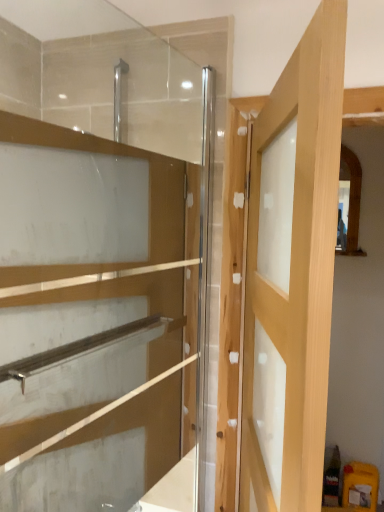
This screenshot has height=512, width=384. Describe the element at coordinates (89, 317) in the screenshot. I see `transparent glass cabinet at upper left` at that location.

Identify the location of transparent glass cabinet at upper left. (89, 317).

Where is `light wood door at center`? The image size is (384, 512). light wood door at center is located at coordinates (303, 246).

Describe the element at coordinates (303, 246) in the screenshot. The width and height of the screenshot is (384, 512). I see `light wood door at center` at that location.

This screenshot has height=512, width=384. In order to click on transparent glass cabinet at upper left in this screenshot , I will do `click(89, 317)`.

Is light wood door at center at the right side of transparent glass cabinet at upper left?

Yes.

Considering the positions of objects light wood door at center and transparent glass cabinet at upper left in the image provided, who is in front, light wood door at center or transparent glass cabinet at upper left?

light wood door at center is in front.

Is point (296, 283) behind point (99, 493)?

No, it is in front of (99, 493).

From the image's perspective, is light wood door at center located above transparent glass cabinet at upper left?

No, from the image's perspective, light wood door at center is not over transparent glass cabinet at upper left.

Looking at this image, from a real-world perspective, which object rests below the other?

light wood door at center, from a real-world perspective.

Between light wood door at center and transparent glass cabinet at upper left, which one has larger width?

light wood door at center.

Consider the image. Considering the relative sizes of light wood door at center and transparent glass cabinet at upper left in the image provided, is light wood door at center shorter than transparent glass cabinet at upper left?

Yes.

Based on their sizes in the image, would you say light wood door at center is bigger or smaller than transparent glass cabinet at upper left?

Considering their sizes, light wood door at center takes up more space than transparent glass cabinet at upper left.

Could transparent glass cabinet at upper left be considered to be inside light wood door at center?

Definitely not — transparent glass cabinet at upper left is not inside light wood door at center.

Are light wood door at center and transparent glass cabinet at upper left located far from each other?

No.

Could you tell me if light wood door at center is facing transparent glass cabinet at upper left?

Yes, light wood door at center is aimed at transparent glass cabinet at upper left.

Find the location of a particular element. The height and width of the screenshot is (512, 384). cabinetry on the left side of light wood door at center is located at coordinates (89, 317).

Can you confirm if transparent glass cabinet at upper left is positioned to the right of light wood door at center?

In fact, transparent glass cabinet at upper left is to the left of light wood door at center.

Which is in front, transparent glass cabinet at upper left or light wood door at center?

Positioned in front is light wood door at center.

Does point (61, 408) appear closer or farther from the camera than point (297, 291)?

Point (61, 408).

From the image's perspective, which is below, transparent glass cabinet at upper left or light wood door at center?

light wood door at center appears lower in the image.

From a real-world perspective, does transparent glass cabinet at upper left stand above light wood door at center?

Correct, in the physical world, transparent glass cabinet at upper left is higher than light wood door at center.

Considering the sizes of transparent glass cabinet at upper left and light wood door at center in the image, is transparent glass cabinet at upper left wider or thinner than light wood door at center?

transparent glass cabinet at upper left is thinner than light wood door at center.

Can you confirm if transparent glass cabinet at upper left is taller than light wood door at center?

Yes.

Based on their sizes in the image, would you say transparent glass cabinet at upper left is bigger or smaller than light wood door at center?

transparent glass cabinet at upper left is smaller than light wood door at center.

Is light wood door at center a part of transparent glass cabinet at upper left?

No, light wood door at center is not a part of transparent glass cabinet at upper left.

Is transparent glass cabinet at upper left directly adjacent to light wood door at center?

No, transparent glass cabinet at upper left is not next to light wood door at center.

Is transparent glass cabinet at upper left looking in the opposite direction of light wood door at center?

Yes, light wood door at center is at the back of transparent glass cabinet at upper left.

Locate an element on the screen. cabinetry that is on the left side of light wood door at center is located at coordinates (89, 317).

Identify the location of door located underneath the transparent glass cabinet at upper left (from a real-world perspective). The width and height of the screenshot is (384, 512). (303, 246).

Find the location of `door that appears below the transparent glass cabinet at upper left (from the image's perspective)`. door that appears below the transparent glass cabinet at upper left (from the image's perspective) is located at coordinates (303, 246).